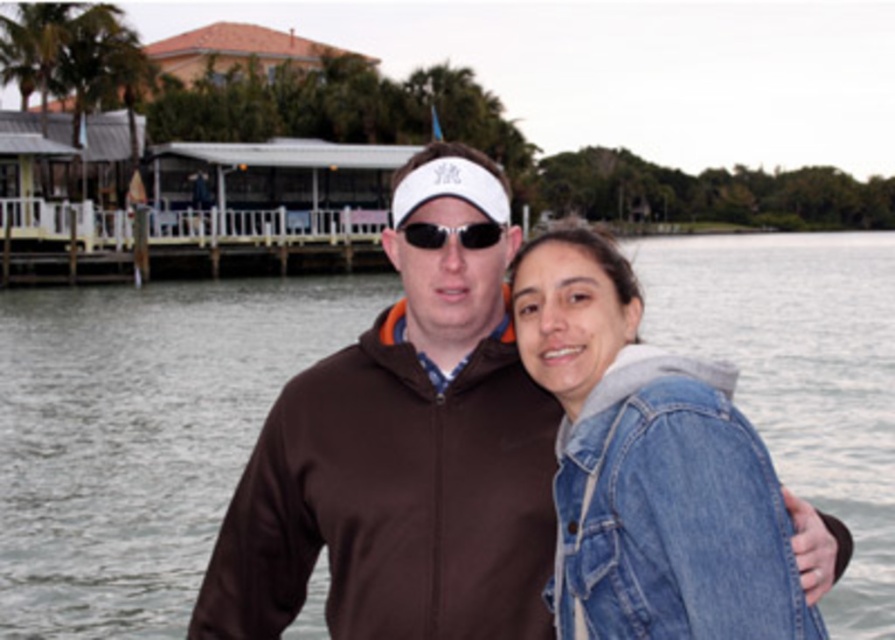
Question: Is denim jacket at lower right in front of black plastic sunglasses at center?

Choices:
 (A) no
 (B) yes

Answer: (B)

Question: From the image, what is the correct spatial relationship of brown softshell jacket at center in relation to denim jacket at lower right?

Choices:
 (A) below
 (B) above

Answer: (B)

Question: Which point appears closest to the camera in this image?

Choices:
 (A) (473, 232)
 (B) (769, 486)

Answer: (B)

Question: Which object appears closest to the camera in this image?

Choices:
 (A) brown softshell jacket at center
 (B) denim jacket at lower right

Answer: (B)

Question: Which of the following is the closest to the observer?

Choices:
 (A) black plastic sunglasses at center
 (B) denim jacket at lower right
 (C) brown softshell jacket at center

Answer: (B)

Question: Where is denim jacket at lower right located in relation to black plastic sunglasses at center in the image?

Choices:
 (A) below
 (B) above

Answer: (A)